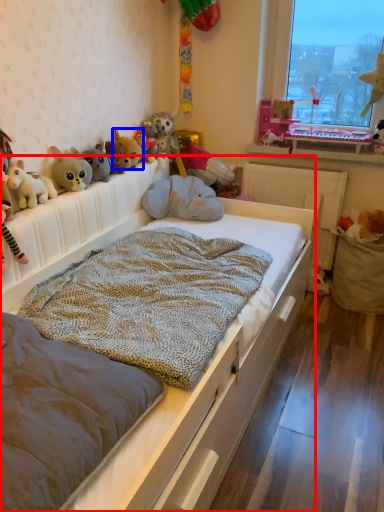
Question: Which point is further to the camera, bed (highlighted by a red box) or toy (highlighted by a blue box)?

Choices:
 (A) bed
 (B) toy

Answer: (B)